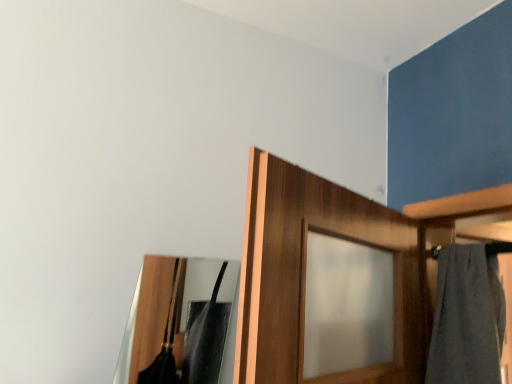
Question: From a real-world perspective, is clear glass mirror at center above or below gray cotton bath towel at right?

Choices:
 (A) above
 (B) below

Answer: (B)

Question: Considering their positions, is clear glass mirror at center located in front of or behind gray cotton bath towel at right?

Choices:
 (A) front
 (B) behind

Answer: (A)

Question: In terms of width, does clear glass mirror at center look wider or thinner when compared to gray cotton bath towel at right?

Choices:
 (A) thin
 (B) wide

Answer: (A)

Question: Relative to clear glass mirror at center, is gray cotton bath towel at right in front or behind?

Choices:
 (A) front
 (B) behind

Answer: (B)

Question: Is point (488, 263) positioned closer to the camera than point (180, 359)?

Choices:
 (A) closer
 (B) farther

Answer: (A)

Question: Visually, is gray cotton bath towel at right positioned to the left or to the right of clear glass mirror at center?

Choices:
 (A) left
 (B) right

Answer: (B)

Question: Considering the positions of gray cotton bath towel at right and clear glass mirror at center in the image, is gray cotton bath towel at right bigger or smaller than clear glass mirror at center?

Choices:
 (A) big
 (B) small

Answer: (A)